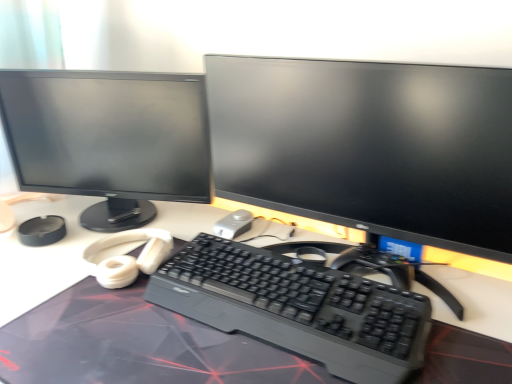
Question: Does point (340, 352) appear closer or farther from the camera than point (228, 213)?

Choices:
 (A) closer
 (B) farther

Answer: (A)

Question: Would you say black plastic keyboard at center is inside or outside satin silver mouse at center?

Choices:
 (A) inside
 (B) outside

Answer: (B)

Question: Estimate the real-world distances between objects in this image. Which object is farther from the matte black monitor at center, which is the 1th computer monitor in right-to-left order?

Choices:
 (A) black plastic keyboard at center
 (B) satin silver mouse at center
 (C) black matte desk at center
 (D) matte black monitor at left, arranged as the first computer monitor when viewed from the left

Answer: (B)

Question: Estimate the real-world distances between objects in this image. Which object is farther from the matte black monitor at center, which is the 1th computer monitor in right-to-left order?

Choices:
 (A) black matte desk at center
 (B) satin silver mouse at center
 (C) black plastic keyboard at center
 (D) matte black monitor at left, arranged as the first computer monitor when viewed from the left

Answer: (B)